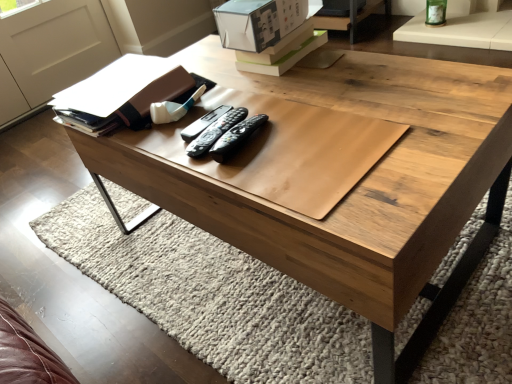
You are a GUI agent. You are given a task and a screenshot of the screen. Output one action in this format:
    pyautogui.click(x=<x>, y=<y>)
    Task: Click on the free space behind black plastic remote at center, marked as the 2th remote in a right-to-left arrangement
    
    Given the screenshot: What is the action you would take?
    pyautogui.click(x=241, y=97)